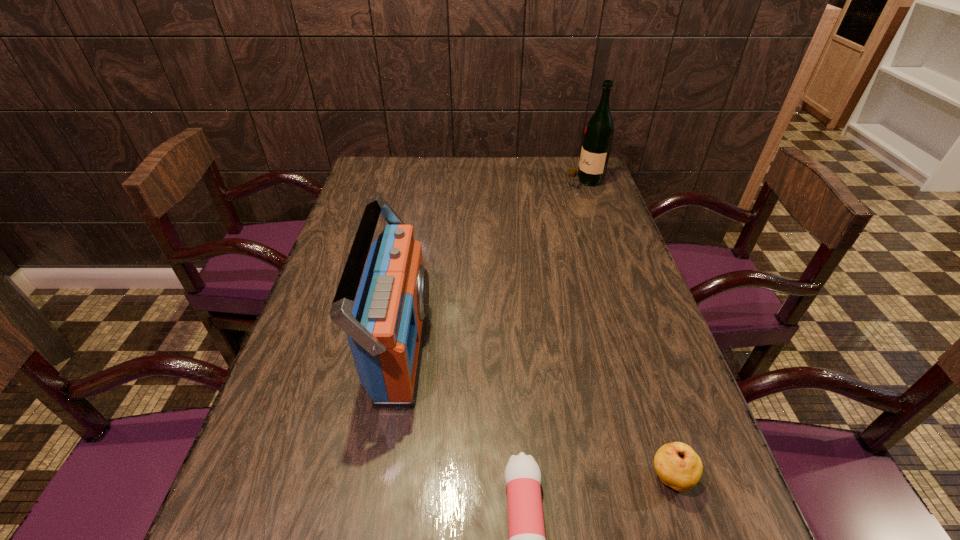
The width and height of the screenshot is (960, 540). In order to click on vacant area between the farthest object and the pear in this screenshot , I will do `click(628, 329)`.

Image resolution: width=960 pixels, height=540 pixels. Identify the location of free space between the radio receiver and the wine bottle. (492, 264).

Locate which object ranks second in proximity to the third nearest object. Please provide its 2D coordinates. Your answer should be formatted as a tuple, i.e. [(x, y)], where the tuple contains the x and y coordinates of a point satisfying the conditions above.

[(678, 466)]

Identify the location of the second closest object to the third tallest object. (385, 329).

This screenshot has width=960, height=540. I want to click on vacant space that satisfies the following two spatial constraints: 1. on the front-facing side of the radio receiver; 2. on the right side of the second shortest object, so click(x=378, y=478).

The image size is (960, 540). I want to click on vacant space that satisfies the following two spatial constraints: 1. on the front-facing side of the third tallest object; 2. on the right side of the third nearest object, so click(x=378, y=478).

The width and height of the screenshot is (960, 540). What are the coordinates of `vacant area in the image that satisfies the following two spatial constraints: 1. on the front-facing side of the radio receiver; 2. on the back side of the third tallest object` in the screenshot? It's located at (378, 478).

Locate an element on the screen. free region that satisfies the following two spatial constraints: 1. on the back side of the second shortest object; 2. on the front-facing side of the leftmost object is located at coordinates (629, 346).